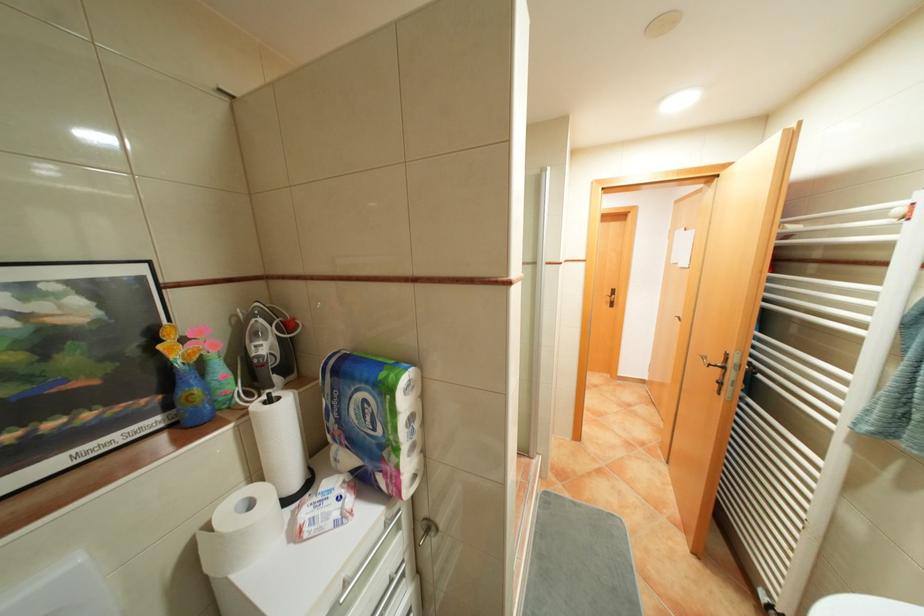
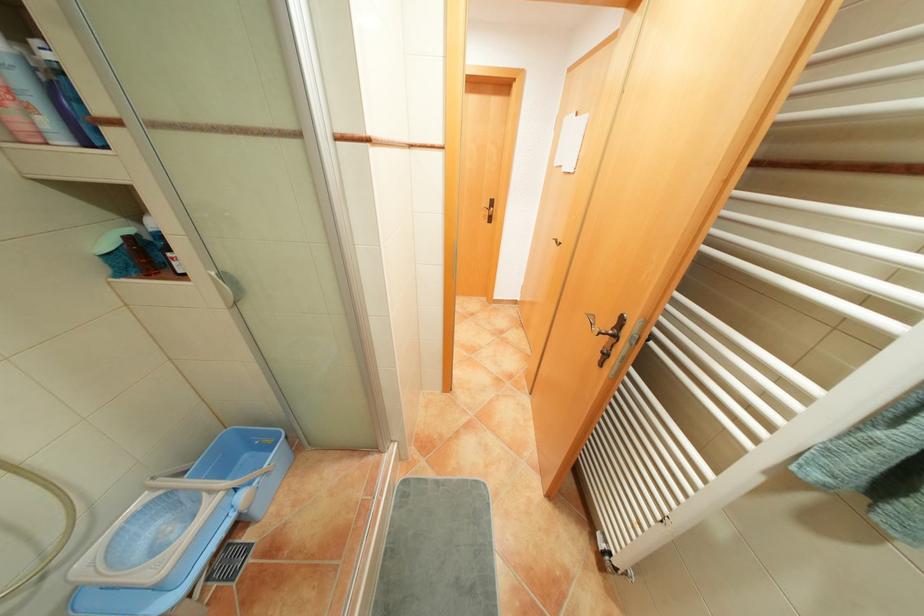
Find the pixel in the second image that matches (x=878, y=427) in the first image.

(828, 475)